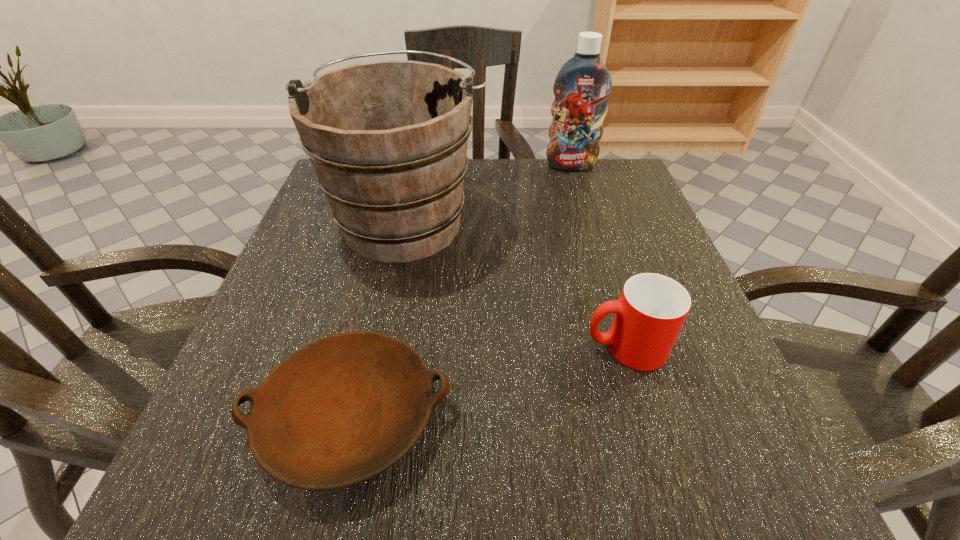
You are a GUI agent. You are given a task and a screenshot of the screen. Output one action in this format:
    pyautogui.click(x=<x>, y=<y>)
    Task: Click on the bucket that is positioned at the far edge
    The width and height of the screenshot is (960, 540).
    Given the screenshot: What is the action you would take?
    pyautogui.click(x=388, y=140)

Identify the location of object that is at the near edge. The width and height of the screenshot is (960, 540). (342, 409).

Locate an element on the screen. bucket that is positioned at the left edge is located at coordinates (388, 140).

The height and width of the screenshot is (540, 960). In order to click on plate present at the left edge in this screenshot , I will do `click(342, 409)`.

Where is `shampoo present at the right edge`? shampoo present at the right edge is located at coordinates (583, 84).

This screenshot has width=960, height=540. Identify the location of cup at the right edge. (652, 308).

This screenshot has width=960, height=540. Identify the location of object at the far left corner. (388, 140).

Where is `object located at the near left corner`? The height and width of the screenshot is (540, 960). object located at the near left corner is located at coordinates (342, 409).

Identify the location of object situated at the far right corner. (583, 84).

You are a GUI agent. You are given a task and a screenshot of the screen. Output one action in this format:
    pyautogui.click(x=<x>, y=<y>)
    Task: Click on the vacant space at the far edge of the desktop
    The image size is (960, 540).
    Given the screenshot: What is the action you would take?
    pyautogui.click(x=546, y=160)